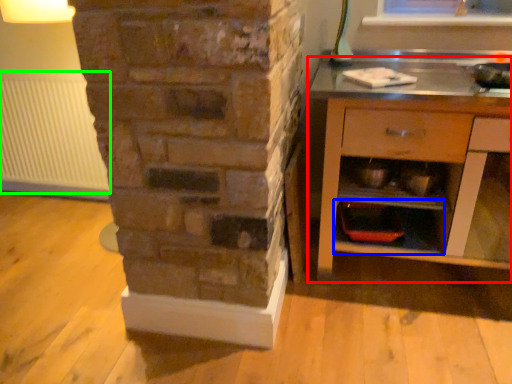
Question: Based on their relative distances, which object is farther from chest of drawers (highlighted by a red box)? Choose from shelf (highlighted by a blue box) and radiator (highlighted by a green box).

Choices:
 (A) shelf
 (B) radiator

Answer: (B)